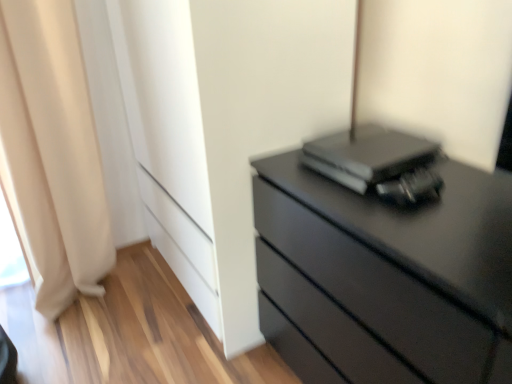
Where is `vacant area located to the right-hand side of beige fabric curtain at left`? The height and width of the screenshot is (384, 512). vacant area located to the right-hand side of beige fabric curtain at left is located at coordinates (157, 303).